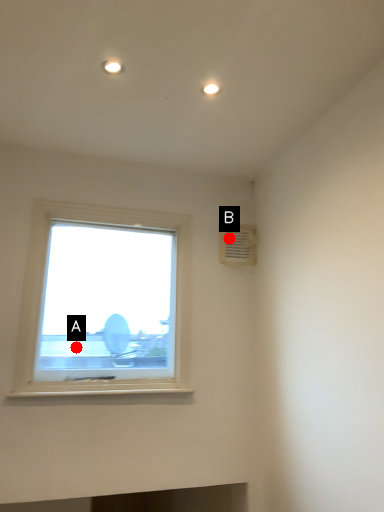
Question: Two points are circled on the image, labeled by A and B beside each circle. Which point is closer to the camera?

Choices:
 (A) A is closer
 (B) B is closer

Answer: (A)